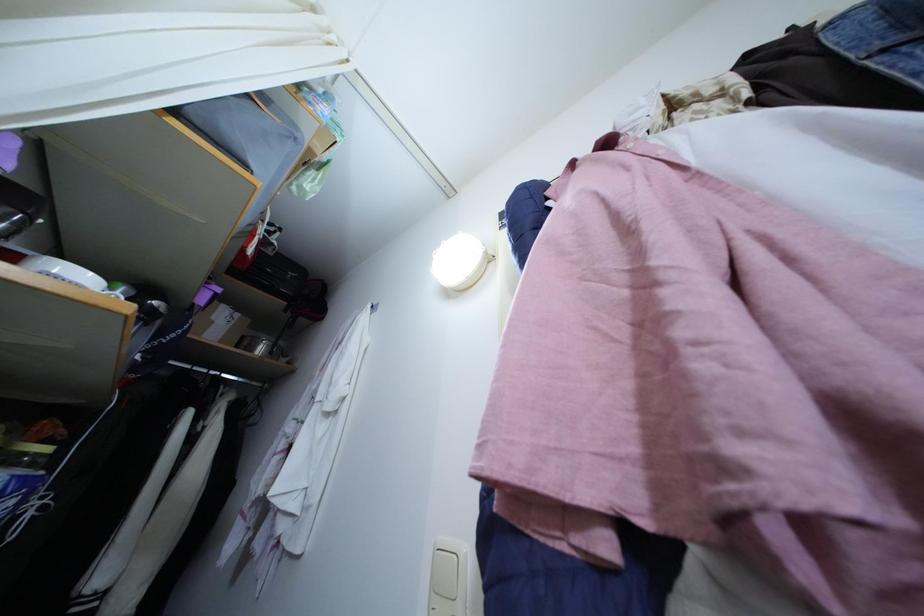
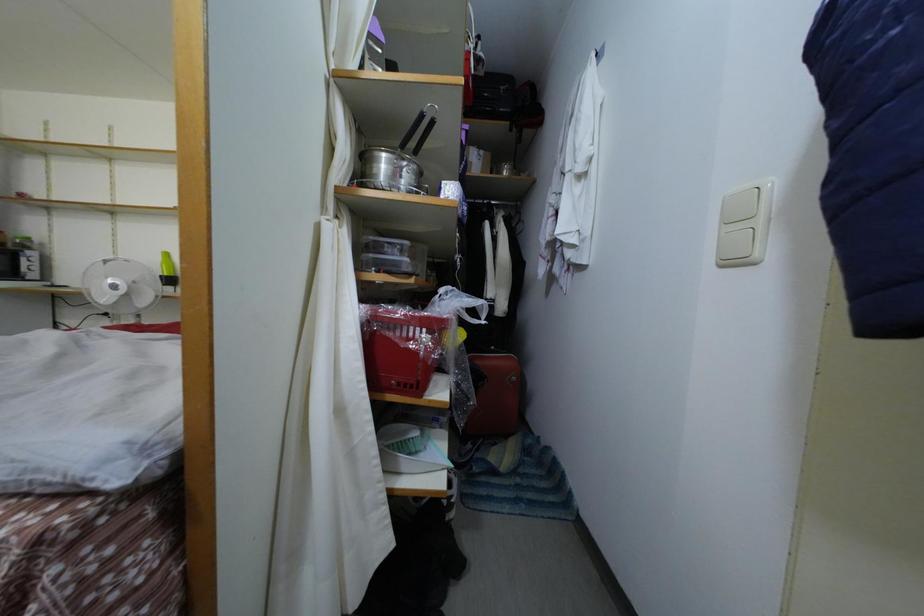
The first image is from the beginning of the video and the second image is from the end. How did the camera likely rotate when shooting the video?

The rotation direction of the camera is left-down.